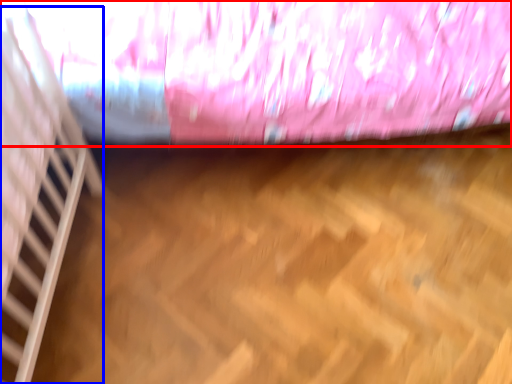
Question: Which object is further to the camera taking this photo, curtain (highlighted by a red box) or stairwell (highlighted by a blue box)?

Choices:
 (A) curtain
 (B) stairwell

Answer: (A)